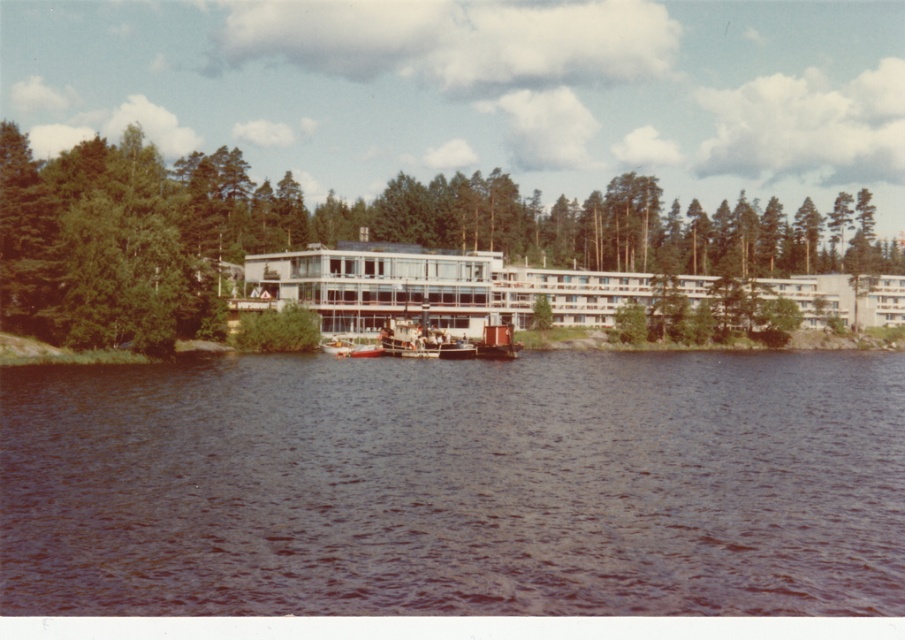
What do you see at coordinates (456, 484) in the screenshot?
I see `brown water at center` at bounding box center [456, 484].

Does brown water at center appear under green leafy tree at center?

Indeed, brown water at center is positioned under green leafy tree at center.

This screenshot has height=640, width=905. What are the coordinates of `brown water at center` in the screenshot? It's located at (456, 484).

This screenshot has height=640, width=905. I want to click on brown water at center, so click(x=456, y=484).

Can you confirm if green leafy tree at center is thinner than matte glass building at center?

No, green leafy tree at center is not thinner than matte glass building at center.

This screenshot has height=640, width=905. Describe the element at coordinates (338, 234) in the screenshot. I see `green leafy tree at center` at that location.

At what (x,y) coordinates should I click in order to perform the action: click on green leafy tree at center. Please return your answer as a coordinate pair (x, y). Image resolution: width=905 pixels, height=640 pixels. Looking at the image, I should click on (338, 234).

Is brown water at center in front of matte glass building at center?

Yes, it is.

Can you confirm if brown water at center is positioned to the left of matte glass building at center?

Correct, you'll find brown water at center to the left of matte glass building at center.

I want to click on brown water at center, so click(x=456, y=484).

In order to click on brown water at center in this screenshot , I will do `click(456, 484)`.